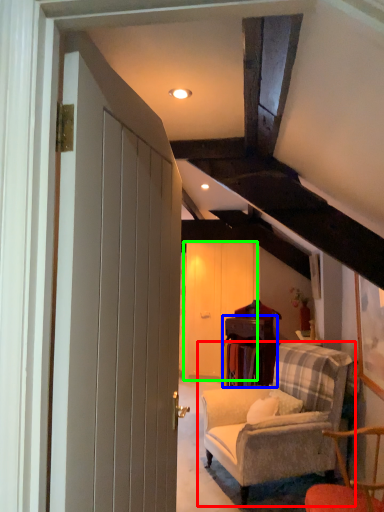
Question: Which object is the closest to the studio couch (highlighted by a red box)? Choose among these: table (highlighted by a blue box) or barn door (highlighted by a green box).

Choices:
 (A) table
 (B) barn door

Answer: (A)